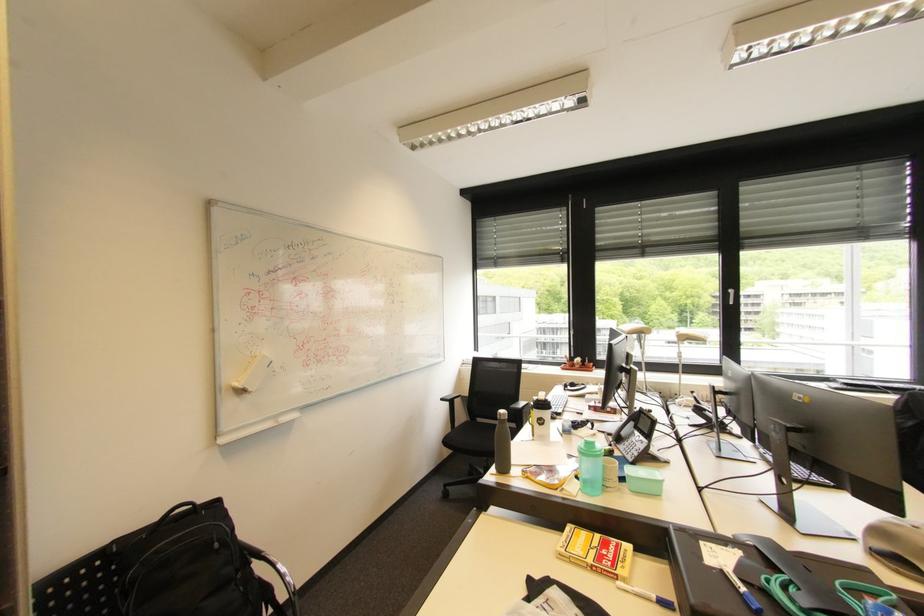
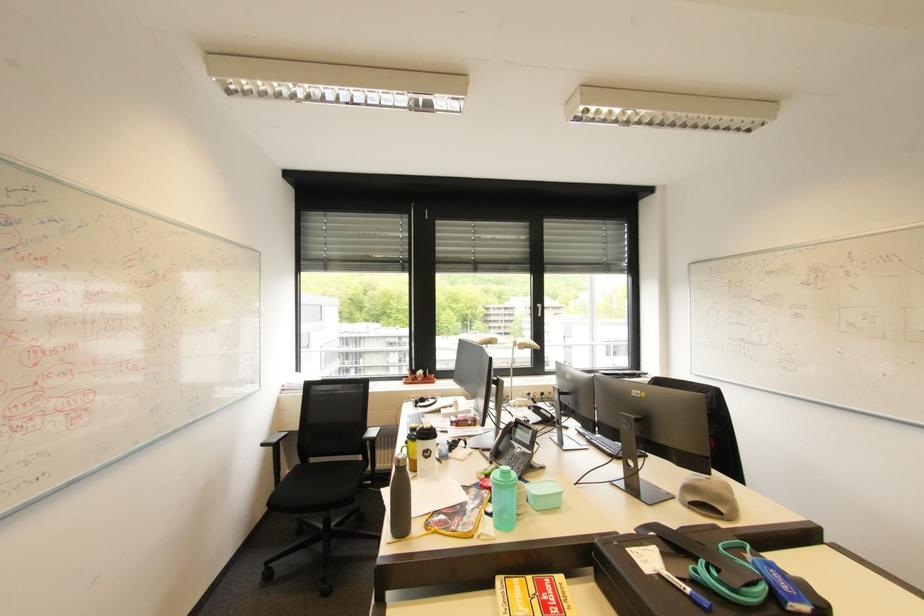
In the second image, find the point that corresponds to point (627, 435) in the first image.

(505, 448)